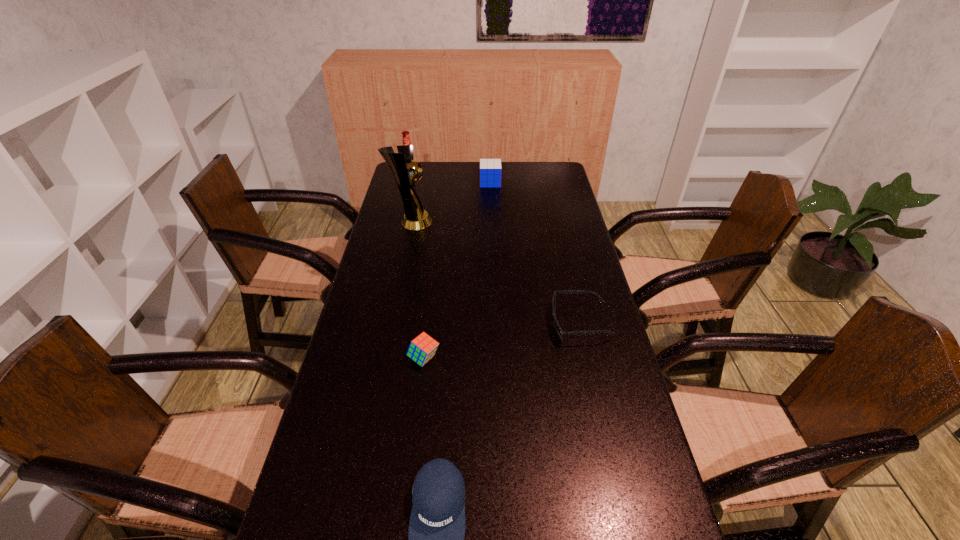
What are the coordinates of `free spot between the tallest object and the rightmost object` in the screenshot? It's located at (495, 273).

Locate an element on the screen. This screenshot has height=540, width=960. vacant space that is in between the farther cube and the nearer cube is located at coordinates (457, 271).

Where is `free space between the sunglasses and the second nearest object`? free space between the sunglasses and the second nearest object is located at coordinates (501, 341).

Find the location of a particular element. This screenshot has width=960, height=540. unoccupied position between the sunglasses and the root beer is located at coordinates (495, 252).

Where is `object that can be found as the third closest to the root beer`? This screenshot has height=540, width=960. object that can be found as the third closest to the root beer is located at coordinates (560, 332).

Locate an element on the screen. This screenshot has height=540, width=960. object that is the fifth closest to the farther cube is located at coordinates (436, 533).

Identify the location of free space that satisfies the following two spatial constraints: 1. on the front side of the root beer; 2. on the right side of the right cube. This screenshot has width=960, height=540. (410, 183).

Image resolution: width=960 pixels, height=540 pixels. I want to click on free space that satisfies the following two spatial constraints: 1. on the front-facing side of the rightmost object; 2. on the front side of the fifth farthest object, so click(588, 358).

You are a GUI agent. You are given a task and a screenshot of the screen. Output one action in this format:
    pyautogui.click(x=<x>, y=<y>)
    Task: Click on the blank space that satisfies the following two spatial constraints: 1. at the front of the tallest object, where the globe is visible; 2. on the left side of the left cube
    The image size is (960, 540).
    Given the screenshot: What is the action you would take?
    pyautogui.click(x=382, y=358)

Identify the location of vacant space that satisfies the following two spatial constraints: 1. on the front side of the second object from right to left; 2. at the front of the award, where the globe is visible. The image size is (960, 540). (492, 222).